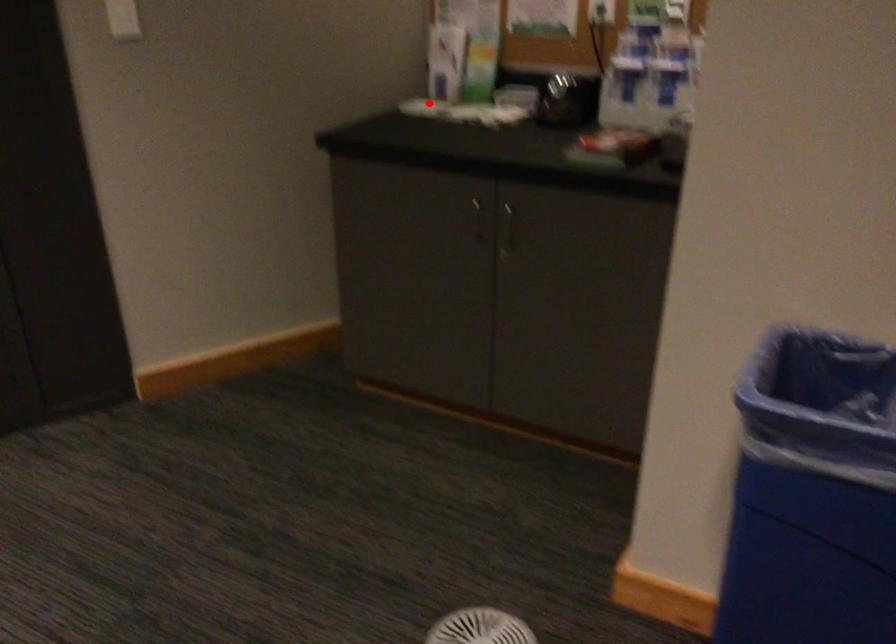
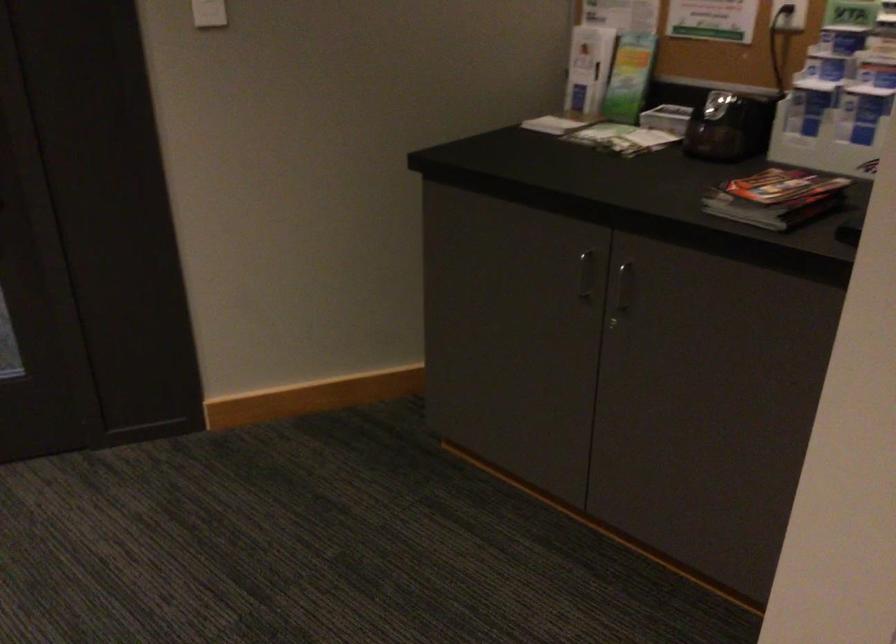
Find the pixel in the second image that matches the highlighted location in the first image.

(556, 122)